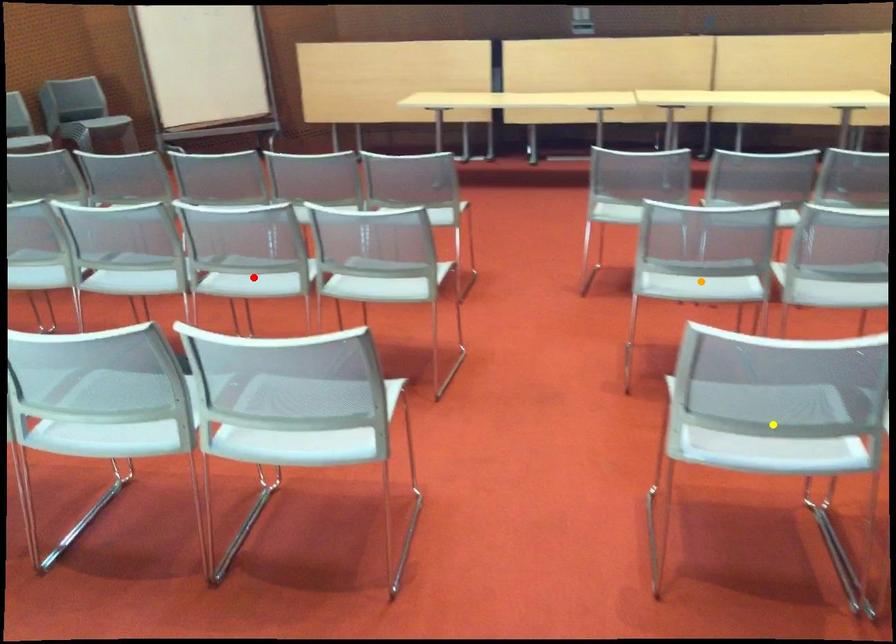
Order these from farthest to nearest:
orange point
red point
yellow point

red point < orange point < yellow point